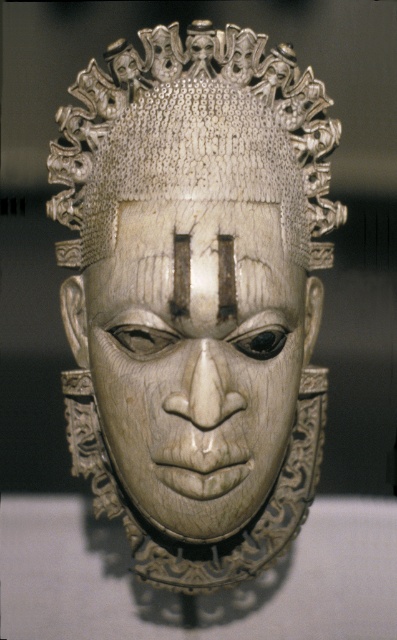
Question: Among these objects, which one is nearest to the camera?

Choices:
 (A) white carved wood mask at center
 (B) ivory textured headdress at center
 (C) white carved wood forehead at center

Answer: (A)

Question: Does ivory textured headdress at center come in front of white carved wood forehead at center?

Choices:
 (A) no
 (B) yes

Answer: (A)

Question: Among these objects, which one is farthest from the camera?

Choices:
 (A) ivory textured headdress at center
 (B) ivory textured mask at center
 (C) white carved wood forehead at center

Answer: (A)

Question: Can you confirm if white carved wood mask at center is thinner than ivory textured headdress at center?

Choices:
 (A) yes
 (B) no

Answer: (A)

Question: Can you confirm if ivory textured mask at center is positioned below white carved wood mask at center?

Choices:
 (A) yes
 (B) no

Answer: (B)

Question: Which point is farther from the camera taking this photo?

Choices:
 (A) (111, 376)
 (B) (134, 461)

Answer: (B)